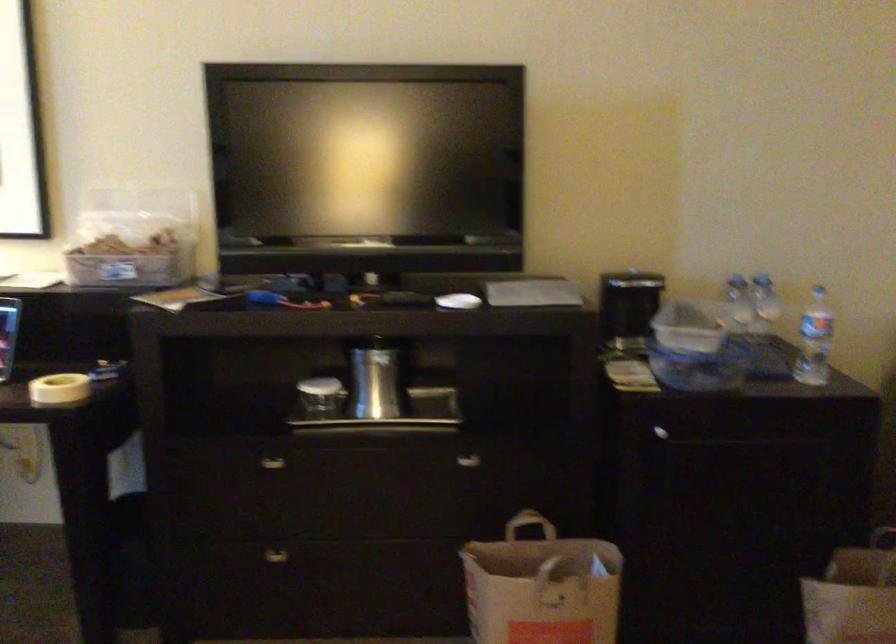
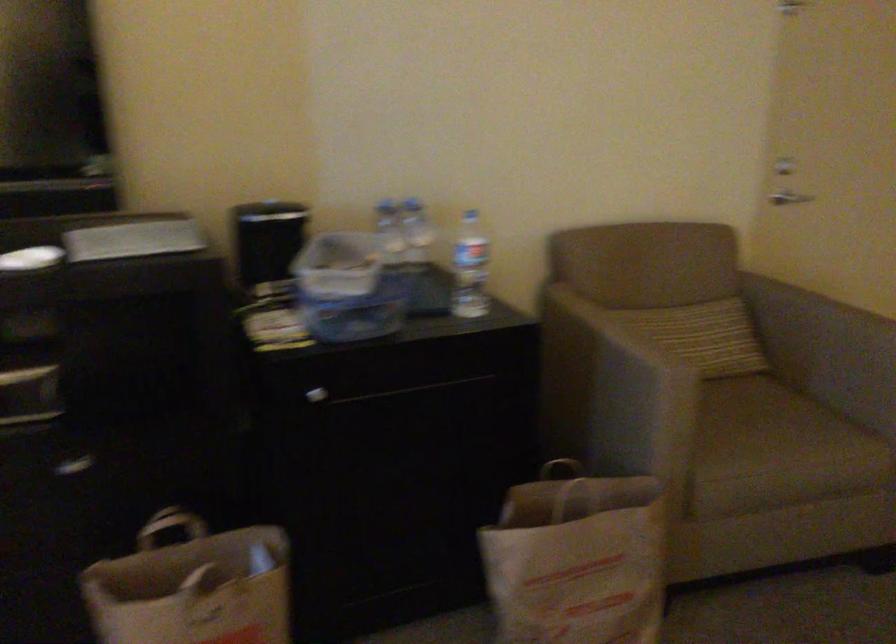
Where in the second image is the point corresponding to the point at 657,431 from the first image?

(316, 395)